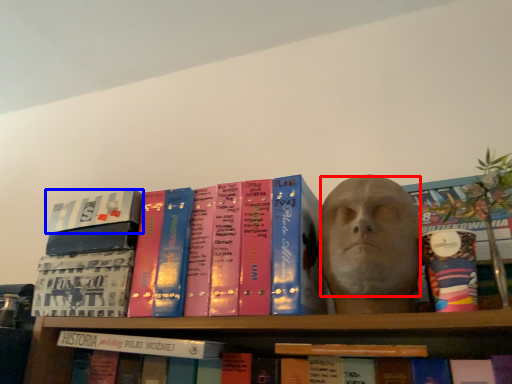
Question: Which object is closer to the camera taking this photo, human face (highlighted by a red box) or book (highlighted by a blue box)?

Choices:
 (A) human face
 (B) book

Answer: (A)